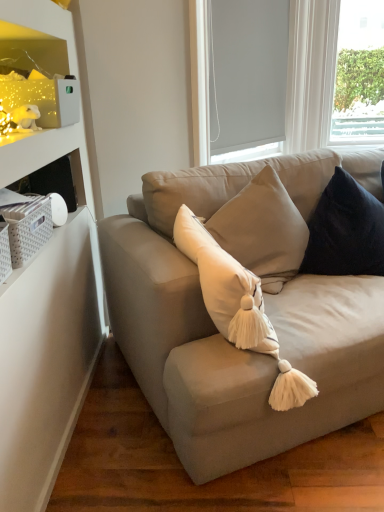
Question: Is white roller blind at upper center at the back of white matte window screen at upper right?

Choices:
 (A) no
 (B) yes

Answer: (B)

Question: Can you confirm if white matte window screen at upper right is bigger than white roller blind at upper center?

Choices:
 (A) yes
 (B) no

Answer: (B)

Question: From a real-world perspective, is white matte window screen at upper right physically below white roller blind at upper center?

Choices:
 (A) yes
 (B) no

Answer: (B)

Question: Is the depth of white matte window screen at upper right less than that of white roller blind at upper center?

Choices:
 (A) yes
 (B) no

Answer: (B)

Question: Considering the relative sizes of white matte window screen at upper right and white roller blind at upper center in the image provided, is white matte window screen at upper right thinner than white roller blind at upper center?

Choices:
 (A) no
 (B) yes

Answer: (B)

Question: Would you say white matte window screen at upper right is to the left or to the right of suede beige couch at center in the picture?

Choices:
 (A) right
 (B) left

Answer: (B)

Question: Looking at the image, does white matte window screen at upper right seem bigger or smaller compared to suede beige couch at center?

Choices:
 (A) small
 (B) big

Answer: (A)

Question: Considering their positions, is white matte window screen at upper right located in front of or behind suede beige couch at center?

Choices:
 (A) behind
 (B) front

Answer: (A)

Question: From the image's perspective, is white matte window screen at upper right positioned above or below suede beige couch at center?

Choices:
 (A) below
 (B) above

Answer: (B)

Question: Visually, is white roller blind at upper center positioned to the left or to the right of suede beige couch at center?

Choices:
 (A) right
 (B) left

Answer: (B)

Question: Is white roller blind at upper center bigger or smaller than suede beige couch at center?

Choices:
 (A) small
 (B) big

Answer: (A)

Question: Relative to suede beige couch at center, is white roller blind at upper center in front or behind?

Choices:
 (A) behind
 (B) front

Answer: (A)

Question: In terms of width, does white roller blind at upper center look wider or thinner when compared to suede beige couch at center?

Choices:
 (A) thin
 (B) wide

Answer: (A)

Question: In the image, is matte white shelf at upper left on the left side or the right side of white roller blind at upper center?

Choices:
 (A) right
 (B) left

Answer: (B)

Question: Considering the positions of matte white shelf at upper left and white roller blind at upper center in the image, is matte white shelf at upper left wider or thinner than white roller blind at upper center?

Choices:
 (A) thin
 (B) wide

Answer: (B)